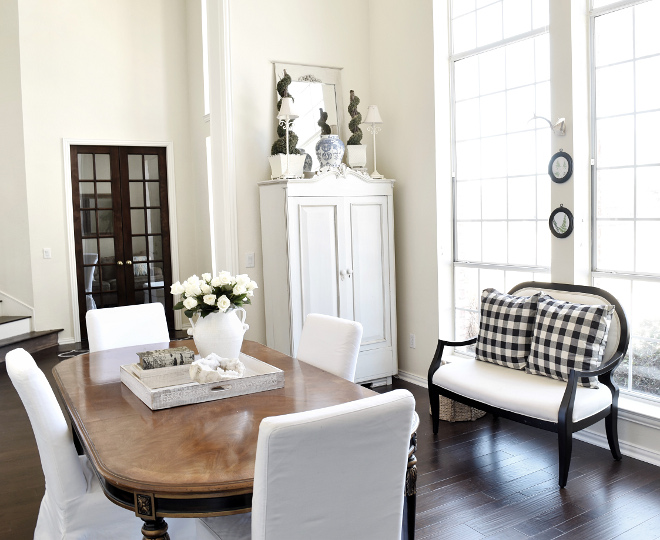
The height and width of the screenshot is (540, 660). In order to click on french doors in this screenshot , I will do `click(127, 251)`.